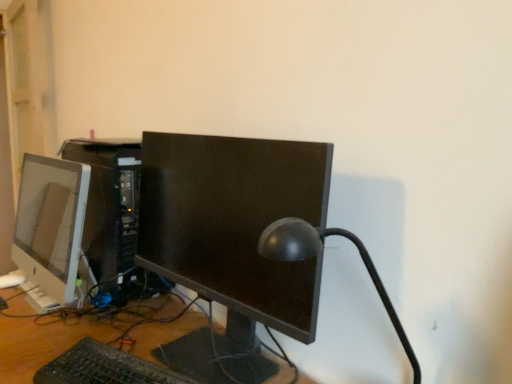
Question: Is satin black lamp at center at the right side of black plastic keyboard at lower center?

Choices:
 (A) no
 (B) yes

Answer: (B)

Question: Is satin black lamp at center next to black plastic keyboard at lower center and touching it?

Choices:
 (A) yes
 (B) no

Answer: (B)

Question: Can you confirm if satin black lamp at center is smaller than black plastic keyboard at lower center?

Choices:
 (A) no
 (B) yes

Answer: (A)

Question: Is satin black lamp at center positioned before black plastic keyboard at lower center?

Choices:
 (A) no
 (B) yes

Answer: (B)

Question: Does satin black lamp at center appear on the left side of black plastic keyboard at lower center?

Choices:
 (A) yes
 (B) no

Answer: (B)

Question: Is black plastic keyboard at lower center inside satin black lamp at center?

Choices:
 (A) no
 (B) yes

Answer: (A)

Question: From the image's perspective, is satin black computer tower at center under satin white monitor at left, arranged as the first computer monitor when viewed from the left?

Choices:
 (A) yes
 (B) no

Answer: (B)

Question: From a real-world perspective, is satin black computer tower at center below satin white monitor at left, arranged as the first computer monitor when viewed from the left?

Choices:
 (A) no
 (B) yes

Answer: (A)

Question: Does satin black computer tower at center lie behind satin white monitor at left, which is counted as the second computer monitor, starting from the right?

Choices:
 (A) yes
 (B) no

Answer: (A)

Question: Is satin black computer tower at center located outside satin white monitor at left, which is counted as the second computer monitor, starting from the right?

Choices:
 (A) yes
 (B) no

Answer: (A)

Question: Considering the relative sizes of satin black computer tower at center and satin white monitor at left, arranged as the first computer monitor when viewed from the left, in the image provided, is satin black computer tower at center shorter than satin white monitor at left, arranged as the first computer monitor when viewed from the left,?

Choices:
 (A) yes
 (B) no

Answer: (B)

Question: Is satin black computer tower at center positioned with its back to satin white monitor at left, arranged as the first computer monitor when viewed from the left?

Choices:
 (A) yes
 (B) no

Answer: (A)

Question: Is satin white monitor at left, arranged as the first computer monitor when viewed from the left, directly adjacent to satin black computer tower at center?

Choices:
 (A) yes
 (B) no

Answer: (B)